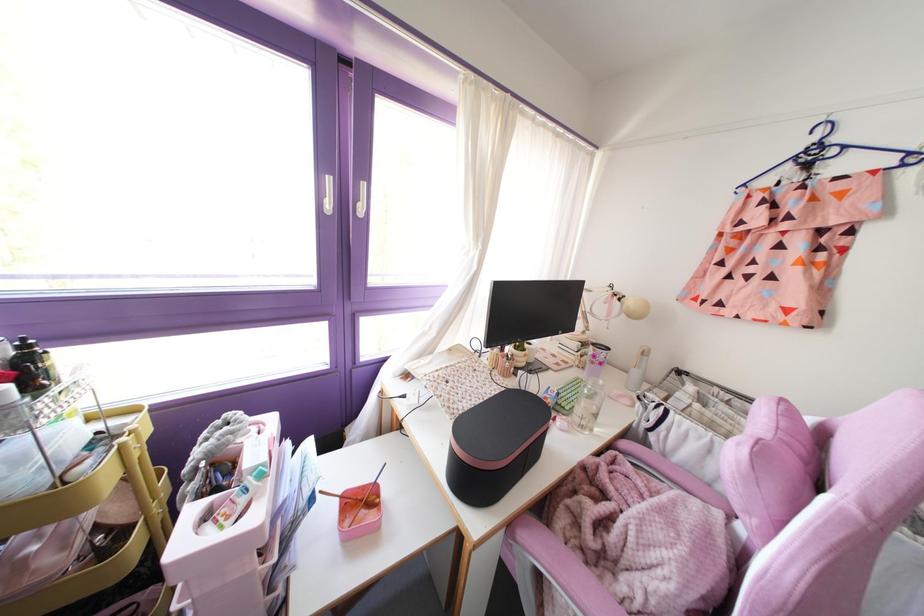
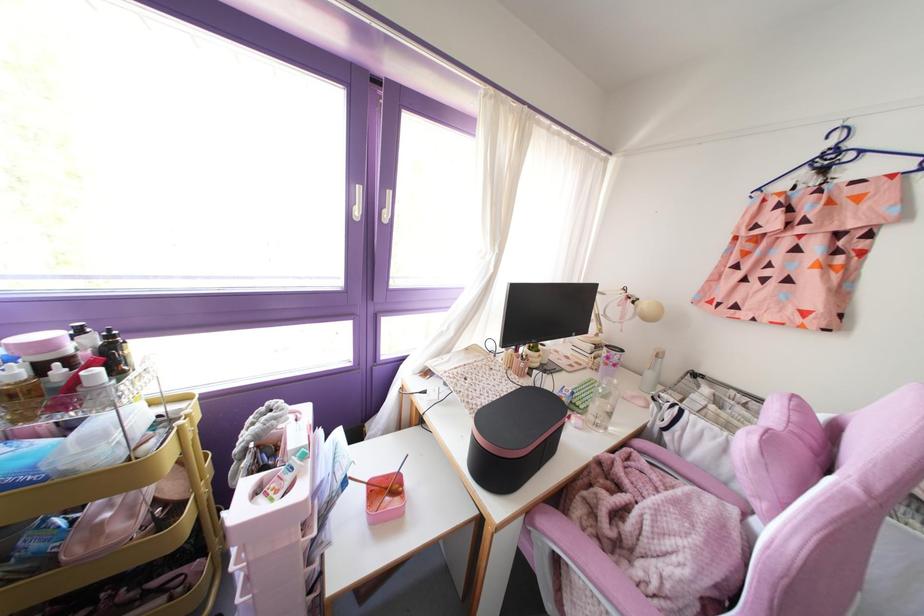
Question: Based on the continuous images, in which direction is the camera rotating? Reply with the corresponding letter.

Choices:
 (A) Left
 (B) Right
 (C) Up
 (D) Down

Answer: (A)